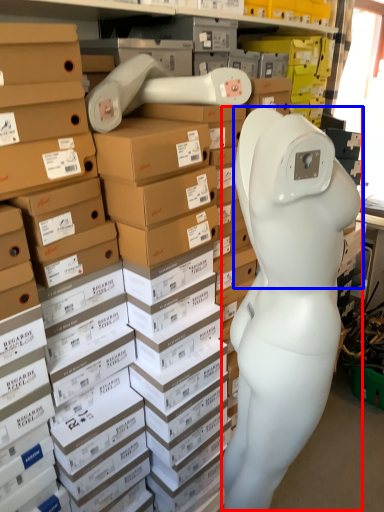
Question: Which object is further to the camera taking this photo, worker (highlighted by a red box) or head (highlighted by a blue box)?

Choices:
 (A) worker
 (B) head

Answer: (B)